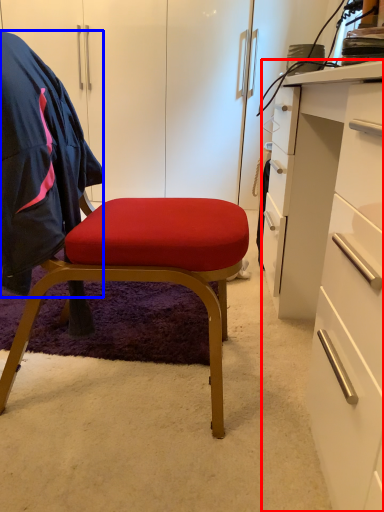
Question: Which point is further to the camera, desk (highlighted by a red box) or clothing (highlighted by a blue box)?

Choices:
 (A) desk
 (B) clothing

Answer: (B)